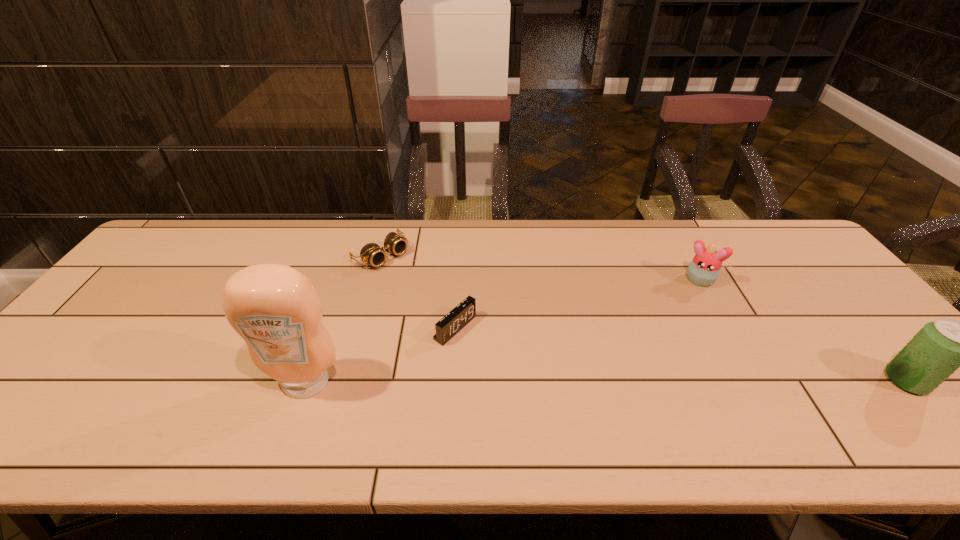
At what (x,y) coordinates should I click in order to perform the action: click on unoccupied position between the rightmost object and the second object from right to left. Please return your answer as a coordinate pair (x, y). Looking at the image, I should click on (802, 331).

Find the location of a particular element. This screenshot has width=960, height=540. vacant point located between the alarm clock and the soda is located at coordinates (681, 354).

Locate an element on the screen. The image size is (960, 540). free space between the second tallest object and the goggles is located at coordinates (644, 318).

You are a GUI agent. You are given a task and a screenshot of the screen. Output one action in this format:
    pyautogui.click(x=<x>, y=<y>)
    Task: Click on the free space between the tallest object and the third shortest object
    The width and height of the screenshot is (960, 540).
    Given the screenshot: What is the action you would take?
    pyautogui.click(x=501, y=332)

Locate an element on the screen. empty space that is in between the cupcake and the tallest object is located at coordinates (501, 332).

Where is `free spot between the third shortest object and the third farthest object`? free spot between the third shortest object and the third farthest object is located at coordinates (576, 305).

Where is `free space between the goggles and the rightmost object`? free space between the goggles and the rightmost object is located at coordinates (644, 318).

I want to click on vacant area between the alarm clock and the second tallest object, so click(681, 354).

Locate which object ranks in proximity to the soda. Please provide its 2D coordinates. Your answer should be formatted as a tuple, i.e. [(x, y)], where the tuple contains the x and y coordinates of a point satisfying the conditions above.

[(704, 269)]

This screenshot has height=540, width=960. What are the coordinates of `object that is the third closest one to the third farthest object` in the screenshot? It's located at (704, 269).